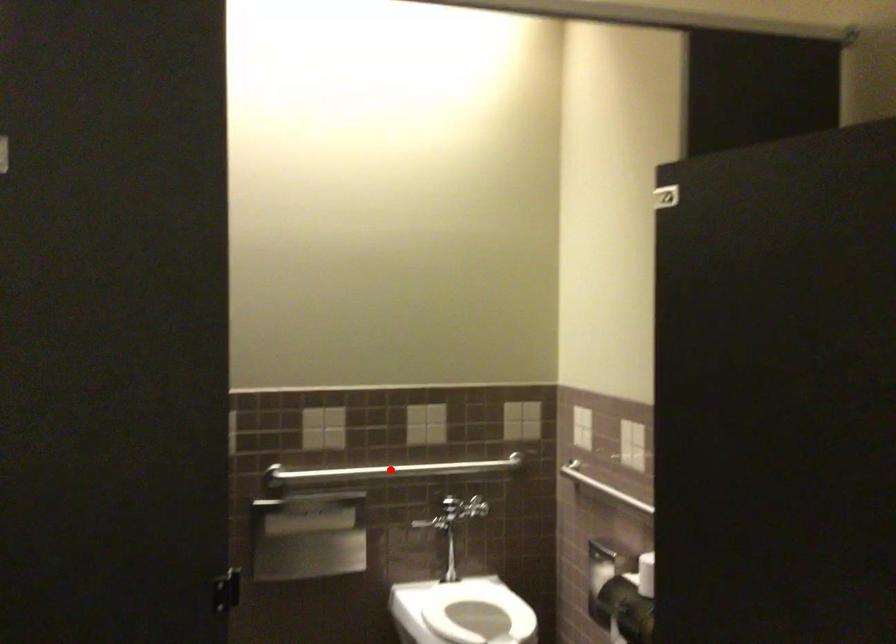
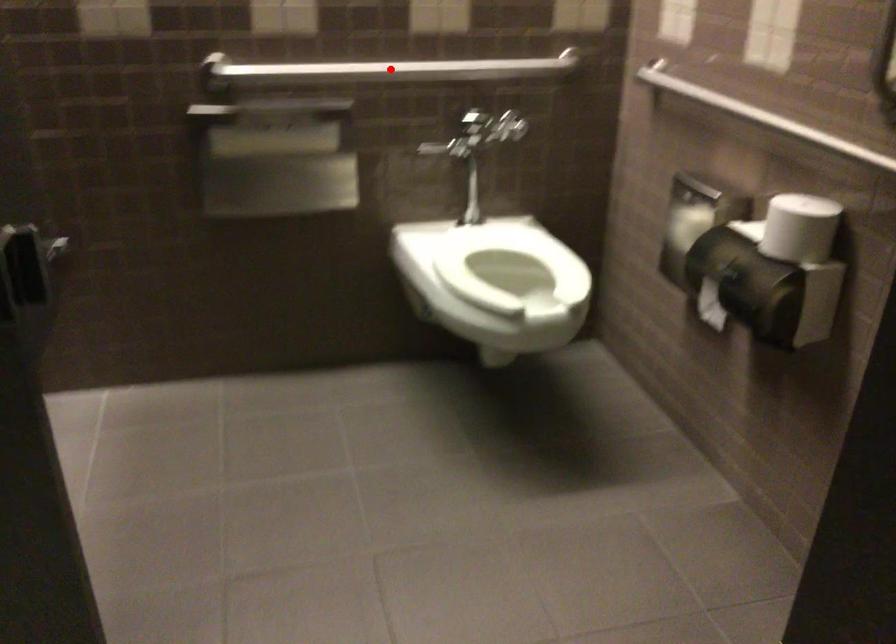
I am providing you with two images of the same scene from different viewpoints. A red point is marked on the first image and another point is marked on the second image. Does the point marked in image1 correspond to the same location as the one in image2?

Yes